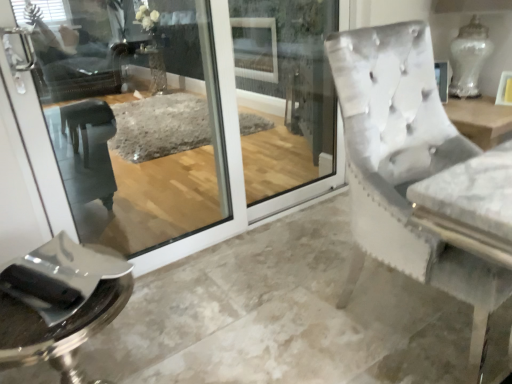
Identify the location of free space behind polished chrome tray at lower left. Image resolution: width=512 pixels, height=384 pixels. click(x=156, y=351).